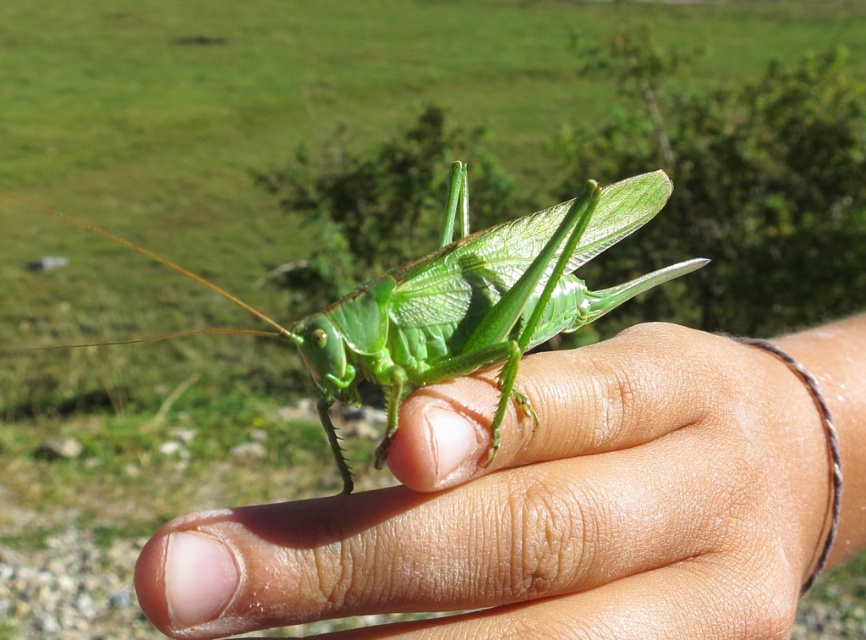
In the scene shown: Based on the scene description, where is the smooth skin hand at center located in the image?

The smooth skin hand at center is located at point (541, 509).